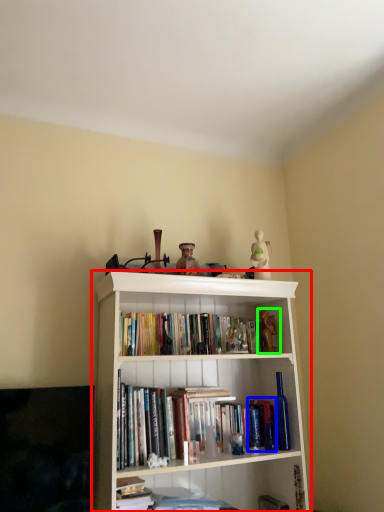
Question: Which object is positioned closest to bookcase (highlighted by a red box)? Select from paperback book (highlighted by a blue box) and toy (highlighted by a green box).

Choices:
 (A) paperback book
 (B) toy

Answer: (A)